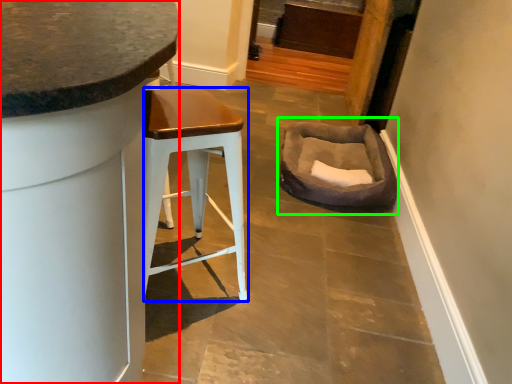
Question: Which is farther away from cabinetry (highlighted by a red box)? stool (highlighted by a blue box) or bean bag chair (highlighted by a green box)?

Choices:
 (A) stool
 (B) bean bag chair

Answer: (B)